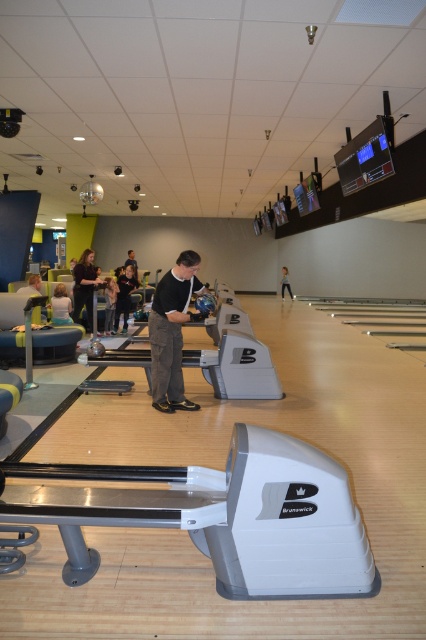
Question: Which is nearer to the light brown hair at lower left?

Choices:
 (A) light blue jeans at center
 (B) dark gray fabric pants at center
 (C) dark gray pants at center

Answer: (C)

Question: Among these objects, which one is nearest to the camera?

Choices:
 (A) light gray shirt at center
 (B) dark gray pants at center

Answer: (A)

Question: Is black leather bowling shoes at center below light blue jeans at center?

Choices:
 (A) yes
 (B) no

Answer: (A)

Question: Where is dark gray fabric pants at center located in relation to dark brown leather jacket at left in the image?

Choices:
 (A) left
 (B) right

Answer: (B)

Question: Among these points, which one is nearest to the camera?

Choices:
 (A) (164, 337)
 (B) (60, 291)
 (C) (40, 282)
 (D) (284, 275)

Answer: (A)

Question: Can you confirm if dark gray fabric pants at center is smaller than light gray shirt at center?

Choices:
 (A) no
 (B) yes

Answer: (A)